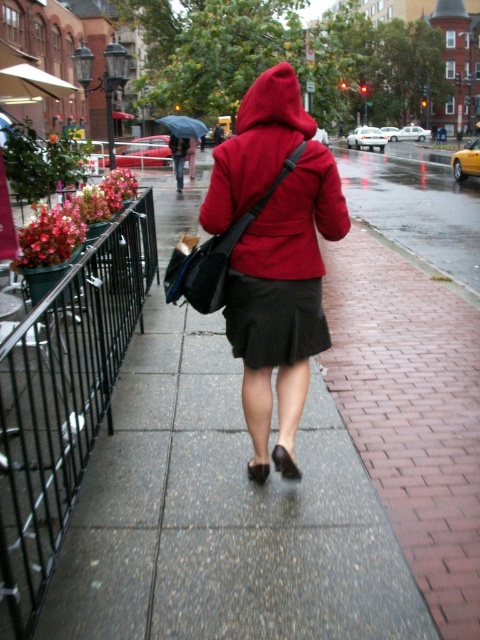
You are a delivery person who needs to walk across the concrete sidewalk at center while holding the blue glossy umbrella at center. Can you walk comfortably without the umbrella hitting the sides of the sidewalk?

The concrete sidewalk at center has a smaller size compared to blue glossy umbrella at center. Since the sidewalk is narrower than the umbrella, the umbrella might hit the sides when walking, making it uncomfortable.

You are a photographer trying to capture the scene. You want to focus on the black satin skirt at center without the concrete sidewalk at center appearing in the foreground. Is this possible?

The concrete sidewalk at center is in front of the black satin skirt at center, so it will block the view of the skirt. You cannot focus on the black satin skirt at center without the concrete sidewalk at center appearing in the foreground.

You are standing at the point marked as point (222,515). Looking around, you see the concrete sidewalk at center. Which direction should you walk to reach the concrete sidewalk at center?

You are already at the concrete sidewalk at center located at point (222,515), so no need to walk in any direction.